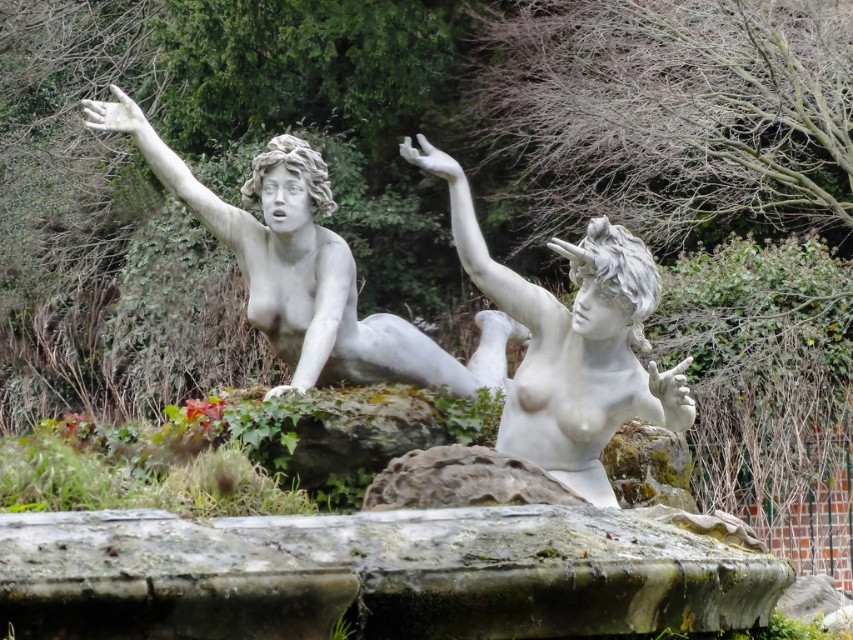
You are a visitor in the garden and want to take a photo of both the white marble mermaid at upper left and the white marble statue at center. Which statue should you stand closer to in order to capture both in a single frame?

You should stand closer to the white marble statue at center because the white marble mermaid at upper left is located above it, so adjusting your position closer to the lower statue will help include both in the frame.

You are an art conservator assessing the statues in the garden. You need to determine which statue is wider to decide which requires a larger protective covering. Which statue between the white marble mermaid at upper left and the white marble statue at center is wider?

The white marble mermaid at upper left is wider than the white marble statue at center, so it requires a larger protective covering.